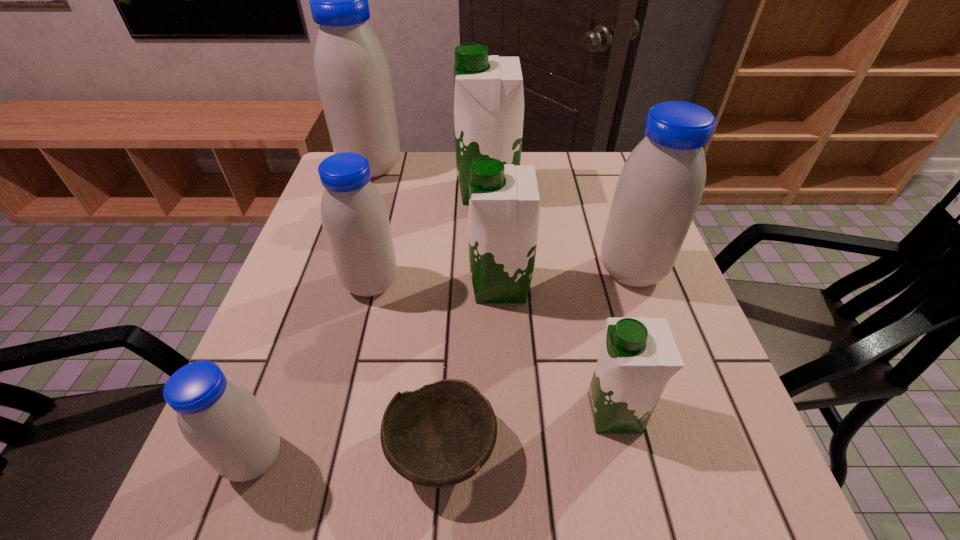
The image size is (960, 540). Identify the location of free point between the second farthest green soya milk and the second smallest blue soya milk. (436, 285).

Identify which object is the seventh closest to the biggest blue soya milk. Please provide its 2D coordinates. Your answer should be formatted as a tuple, i.e. [(x, y)], where the tuple contains the x and y coordinates of a point satisfying the conditions above.

[(639, 355)]

You are a GUI agent. You are given a task and a screenshot of the screen. Output one action in this format:
    pyautogui.click(x=<x>, y=<y>)
    Task: Click on the object that stands as the closest to the second smallest blue soya milk
    This screenshot has height=540, width=960.
    Given the screenshot: What is the action you would take?
    pyautogui.click(x=504, y=205)

Locate an element on the screen. Image resolution: width=960 pixels, height=540 pixels. the second closest soya milk to the rightmost blue soya milk is located at coordinates (639, 355).

Locate an element on the screen. Image resolution: width=960 pixels, height=540 pixels. soya milk that can be found as the second closest to the second smallest blue soya milk is located at coordinates (489, 98).

Point out which blue soya milk is positioned as the nearest to the smallest green soya milk. Please provide its 2D coordinates. Your answer should be formatted as a tuple, i.e. [(x, y)], where the tuple contains the x and y coordinates of a point satisfying the conditions above.

[(659, 189)]

Point out which blue soya milk is positioned as the second nearest to the third smallest blue soya milk. Please provide its 2D coordinates. Your answer should be formatted as a tuple, i.e. [(x, y)], where the tuple contains the x and y coordinates of a point satisfying the conditions above.

[(352, 73)]

Locate an element on the screen. The width and height of the screenshot is (960, 540). green soya milk that is the second closest to the nearest blue soya milk is located at coordinates (639, 355).

Locate which green soya milk is the closest to the nearest blue soya milk. Please provide its 2D coordinates. Your answer should be formatted as a tuple, i.e. [(x, y)], where the tuple contains the x and y coordinates of a point satisfying the conditions above.

[(504, 205)]

Where is `vacant space that satisfies the following two spatial constraints: 1. on the front side of the third smallest blue soya milk; 2. on the front-facing side of the rightmost green soya milk`? vacant space that satisfies the following two spatial constraints: 1. on the front side of the third smallest blue soya milk; 2. on the front-facing side of the rightmost green soya milk is located at coordinates (681, 412).